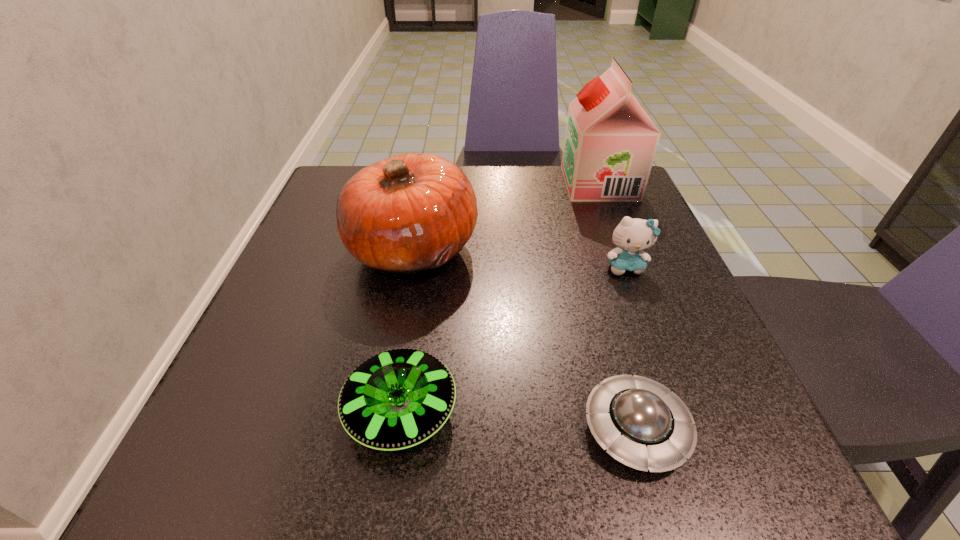
Identify which object is the second nearest to the fourth shortest object. Please provide its 2D coordinates. Your answer should be formatted as a tuple, i.e. [(x, y)], where the tuple contains the x and y coordinates of a point satisfying the conditions above.

[(610, 143)]

Image resolution: width=960 pixels, height=540 pixels. In order to click on free space that satisfies the following two spatial constraints: 1. with the cap open on the tallest object; 2. on the face of the kitten in this screenshot , I will do `click(632, 267)`.

Image resolution: width=960 pixels, height=540 pixels. In order to click on free space that satisfies the following two spatial constraints: 1. with the cap open on the soya milk; 2. on the face of the third tallest object in this screenshot , I will do `click(632, 267)`.